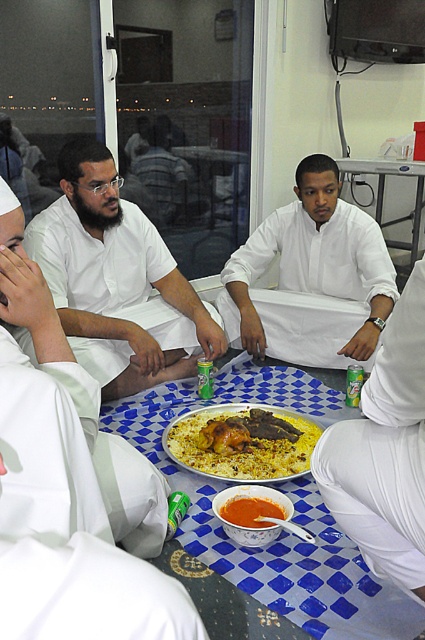
You are a photographer at the event and want to ensure both the matte white shirt at center and the white matte shirt at center are clearly visible in your photo. Given their sizes, which one should you focus on to ensure it doesn

The matte white shirt at center occupies less space than the white matte shirt at center, so focusing on the white matte shirt at center would ensure it is clearly visible due to its larger size.

Looking at this image, you are standing at the origin point of the coordinate system in the image. The table is in front of you. Where is the matte white shirt at center located relative to you?

The matte white shirt at center is located at the coordinates point (116, 278) in the image.